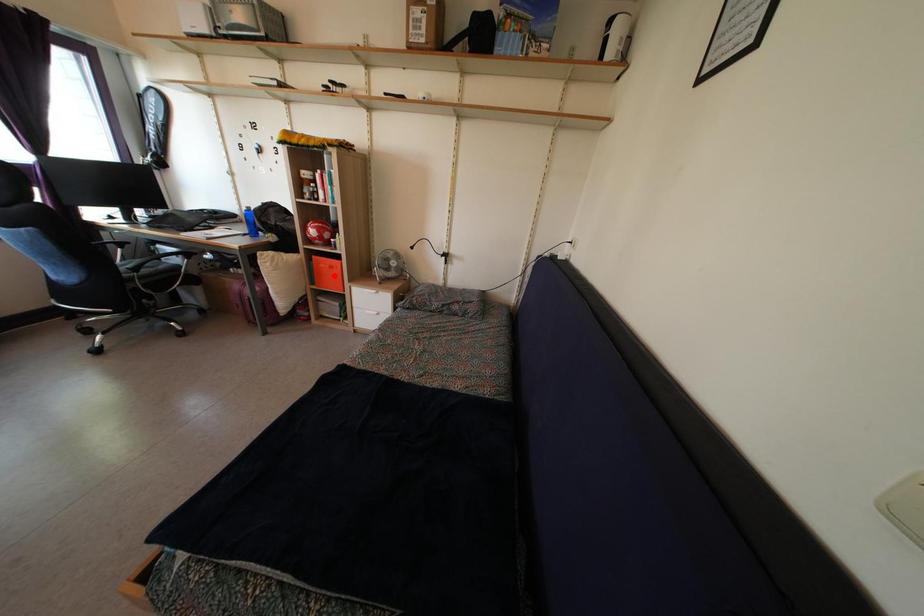
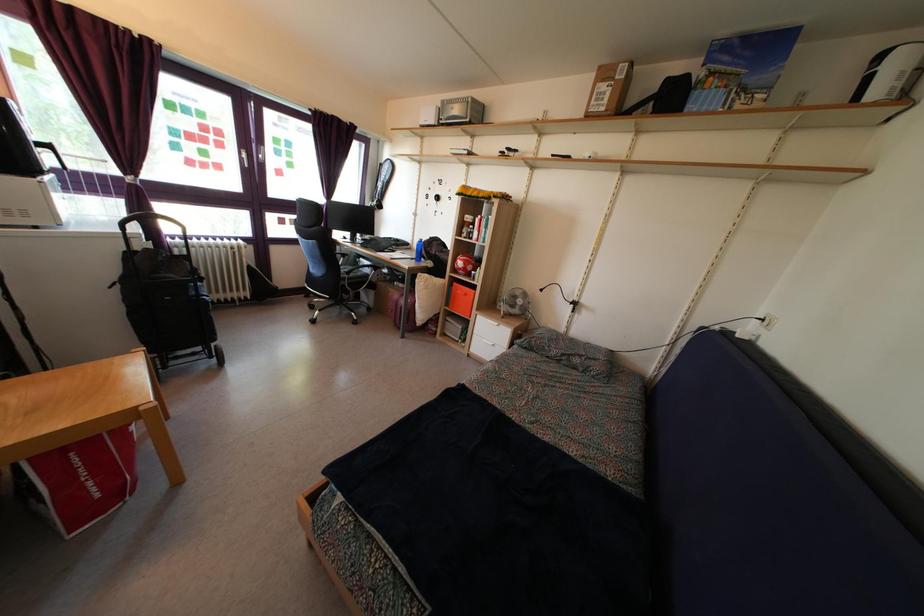
Question: I am providing you with two images of the same scene from different viewpoints. Given a red point in image1, look at the same physical point in image2. Is it:

Choices:
 (A) Closer to the viewpoint
 (B) Farther from the viewpoint

Answer: (B)